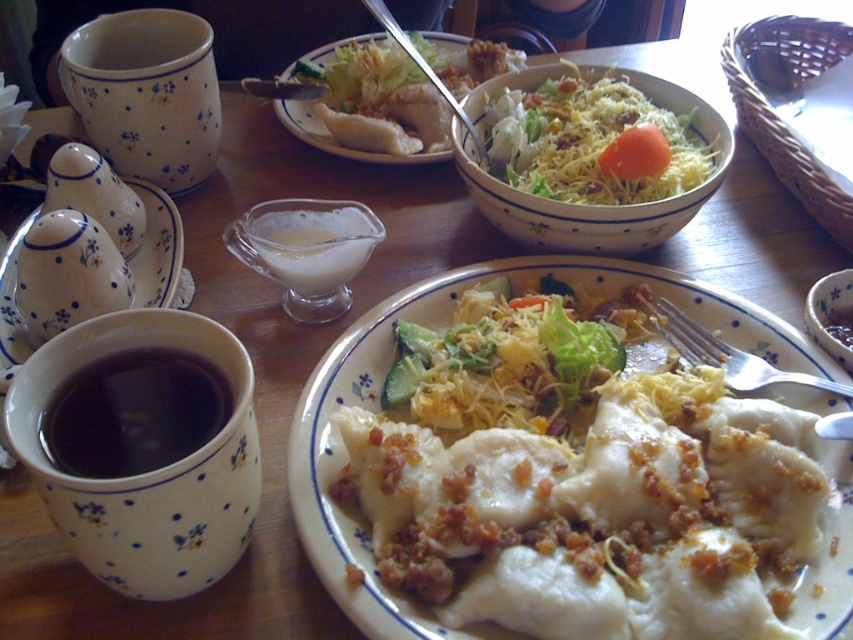
Is white dumplings at center thinner than dark matte cup at left?

Incorrect, white dumplings at center's width is not less than dark matte cup at left's.

Looking at this image, who is taller, white dumplings at center or dark matte cup at left?

With more height is white dumplings at center.

Locate an element on the screen. white dumplings at center is located at coordinates (444, 326).

At what (x,y) coordinates should I click in order to perform the action: click on white dumplings at center. Please return your answer as a coordinate pair (x, y). Looking at the image, I should click on (444, 326).

Between point (151, 445) and point (143, 262), which one is positioned in front?

Point (151, 445)

Which is above, dark matte cup at left or white ceramic sugar bowl at left?

white ceramic sugar bowl at left

Is point (199, 388) farther from viewer compared to point (137, 257)?

No, it is not.

The image size is (853, 640). In order to click on dark matte cup at left in this screenshot , I will do `click(134, 413)`.

Between dark matte cup at lower left and white ceramic sugar bowl at left, which one has more height?

Result: With more height is white ceramic sugar bowl at left.

Does point (32, 410) lie in front of point (137, 276)?

That is True.

I want to click on dark matte cup at lower left, so click(x=149, y=470).